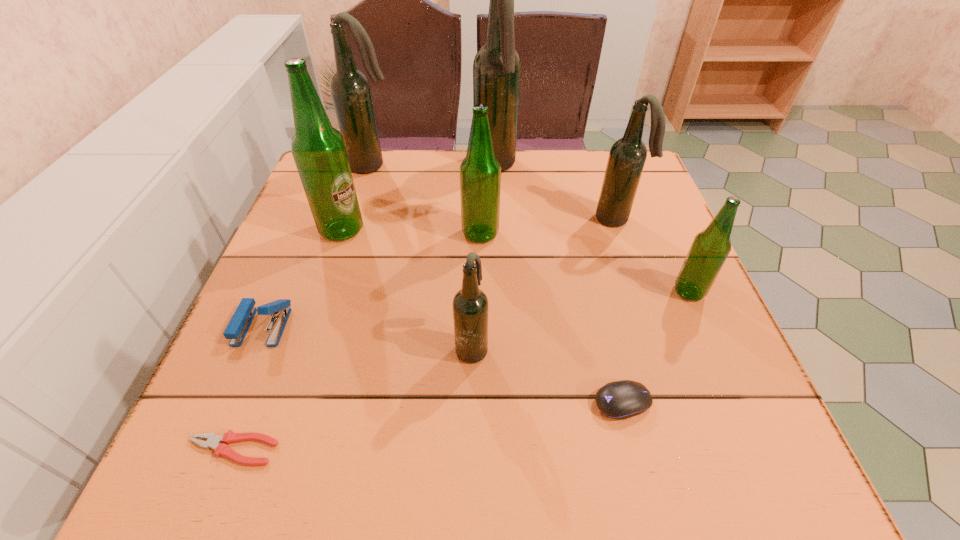
Image resolution: width=960 pixels, height=540 pixels. I want to click on vacant space at the near left corner, so click(x=226, y=485).

The image size is (960, 540). Identify the location of vacant space at the near right corner of the desktop. (704, 476).

Locate an element on the screen. Image resolution: width=960 pixels, height=540 pixels. vacant area between the biggest dark beer bottle and the leftmost dark beer bottle is located at coordinates (434, 166).

What are the coordinates of `vacant space that's between the tallest beer bottle and the eighth tallest object` in the screenshot? It's located at (378, 246).

The height and width of the screenshot is (540, 960). What are the coordinates of `unoccupied area between the second biggest dark beer bottle and the shortest object` in the screenshot? It's located at (303, 308).

The width and height of the screenshot is (960, 540). In order to click on vacant space that is in between the third biggest dark beer bottle and the smallest dark beer bottle in this screenshot , I will do `click(543, 282)`.

Where is `vacant space that is in between the tallest beer bottle and the leftmost dark beer bottle`? vacant space that is in between the tallest beer bottle and the leftmost dark beer bottle is located at coordinates (434, 166).

Find the location of a particular element. free spot between the leftmost dark beer bottle and the sixth farthest beer bottle is located at coordinates (531, 228).

You are a GUI agent. You are given a task and a screenshot of the screen. Output one action in this format:
    pyautogui.click(x=<x>, y=<y>)
    Task: Click on the vacant area that lies between the leftmost dark beer bottle and the biggest green beer bottle
    
    Given the screenshot: What is the action you would take?
    coord(357,198)

Where is `vacant space that is in between the second beer bottle from right to left and the blue stapler`? The width and height of the screenshot is (960, 540). vacant space that is in between the second beer bottle from right to left and the blue stapler is located at coordinates pos(439,272).